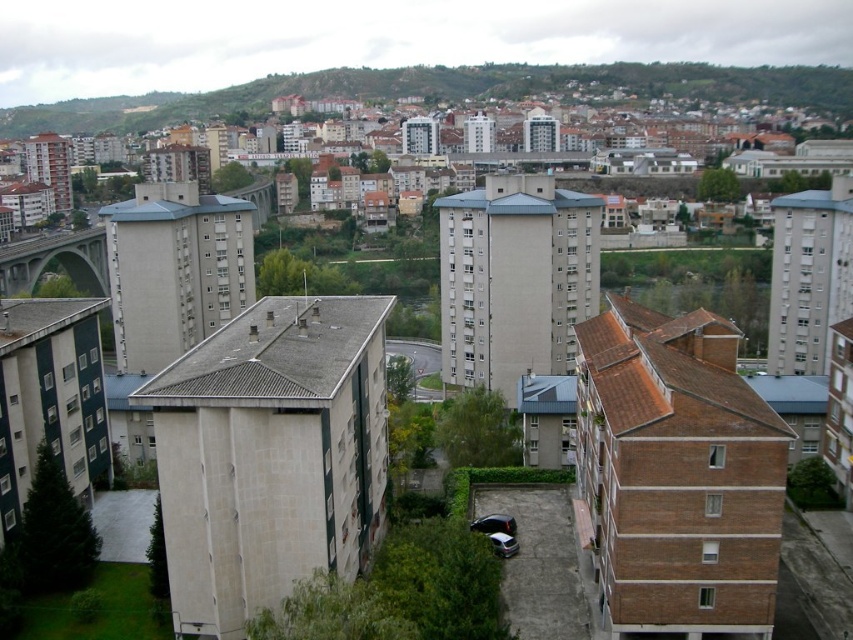
Question: Is green grassy hillside at upper center closer to camera compared to shiny black car at center?

Choices:
 (A) no
 (B) yes

Answer: (A)

Question: Is green grassy hillside at upper center smaller than shiny black car at center?

Choices:
 (A) yes
 (B) no

Answer: (B)

Question: Which point is closer to the camera?

Choices:
 (A) green grassy hillside at upper center
 (B) silver metallic car at center

Answer: (B)

Question: Which object is positioned closest to the silver metallic car at center?

Choices:
 (A) green grassy hillside at upper center
 (B) shiny black car at center

Answer: (B)

Question: Can you confirm if shiny black car at center is smaller than silver metallic car at center?

Choices:
 (A) no
 (B) yes

Answer: (A)

Question: Which of these objects is positioned farthest from the green grassy hillside at upper center?

Choices:
 (A) silver metallic car at center
 (B) shiny black car at center

Answer: (A)